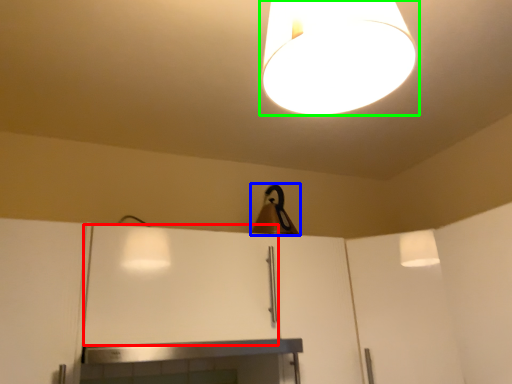
Question: Estimate the real-world distances between objects in this image. Which object is farther from cabinetry (highlighted by a red box), lamp (highlighted by a blue box) or lamp (highlighted by a green box)?

Choices:
 (A) lamp
 (B) lamp

Answer: (B)